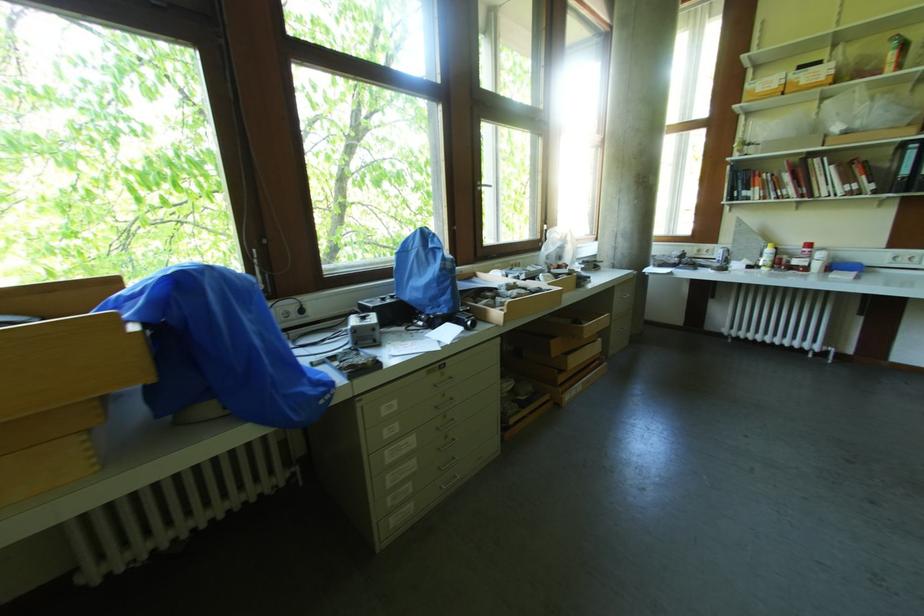
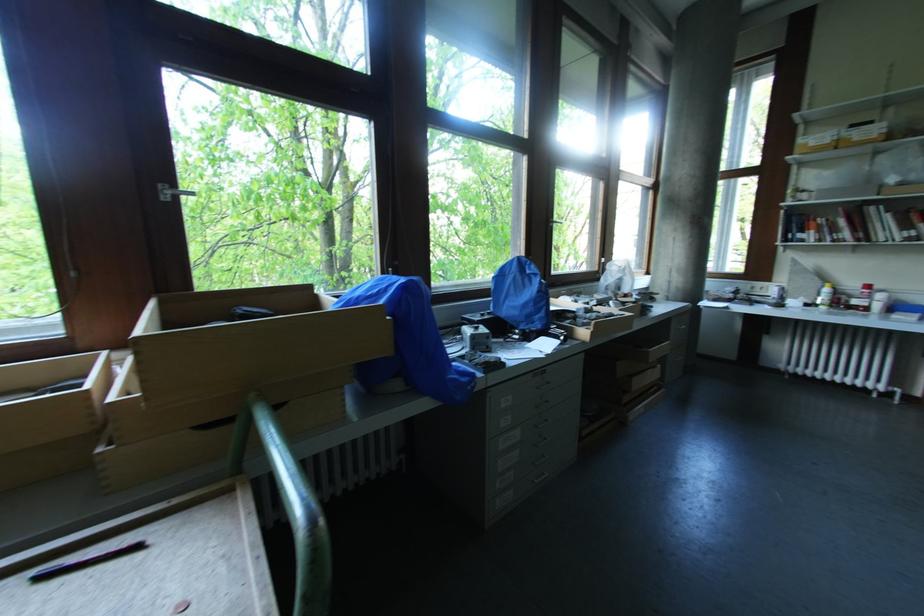
Where in the second image is the point corresponding to point 811,246 from the first image?

(871, 288)